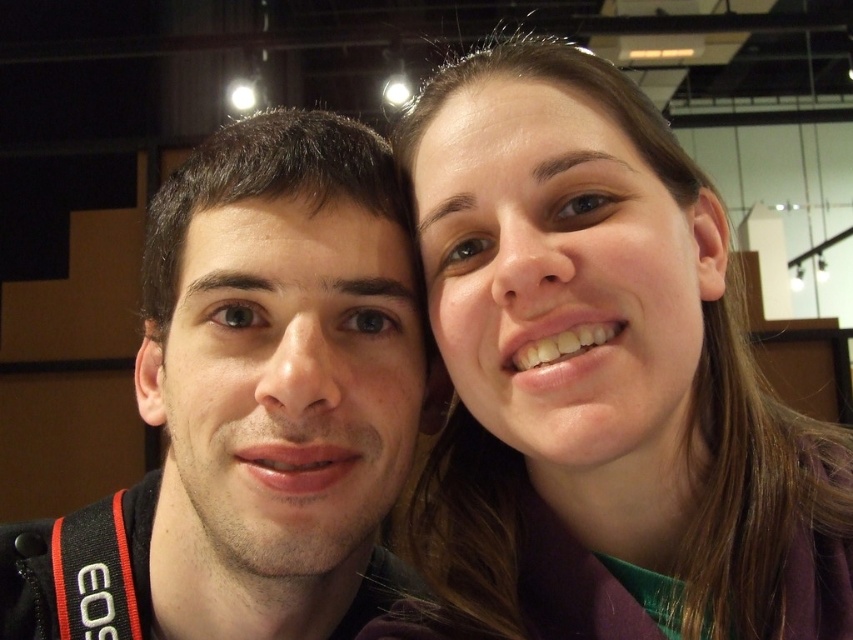
Question: Observing the image, what is the correct spatial positioning of smooth brown hair at upper right in reference to matte black jacket at left?

Choices:
 (A) left
 (B) right

Answer: (B)

Question: Is smooth brown hair at upper right bigger than matte black jacket at left?

Choices:
 (A) no
 (B) yes

Answer: (B)

Question: Which object appears farthest from the camera in this image?

Choices:
 (A) smooth brown hair at upper right
 (B) matte black jacket at left

Answer: (B)

Question: Among these objects, which one is nearest to the camera?

Choices:
 (A) smooth brown hair at upper right
 (B) matte black jacket at left

Answer: (A)

Question: Does smooth brown hair at upper right appear under matte black jacket at left?

Choices:
 (A) no
 (B) yes

Answer: (A)